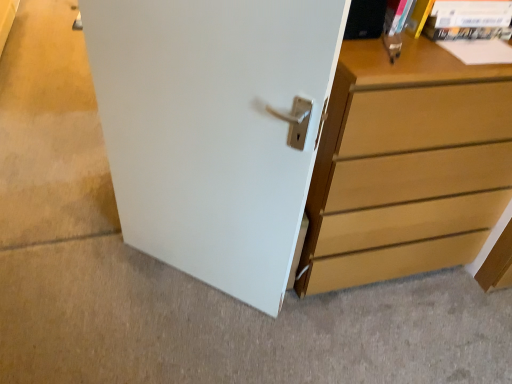
Question: Choose the correct answer: Is white matte door at center inside white smooth door at center or outside it?

Choices:
 (A) outside
 (B) inside

Answer: (A)

Question: In terms of width, does white matte door at center look wider or thinner when compared to white smooth door at center?

Choices:
 (A) wide
 (B) thin

Answer: (B)

Question: Estimate the real-world distances between objects in this image. Which object is closer to the white matte door at center?

Choices:
 (A) light brown wood chest of drawers at right
 (B) white smooth door at center

Answer: (A)

Question: Based on their relative distances, which object is nearer to the light brown wood chest of drawers at right?

Choices:
 (A) white smooth door at center
 (B) white matte door at center

Answer: (B)